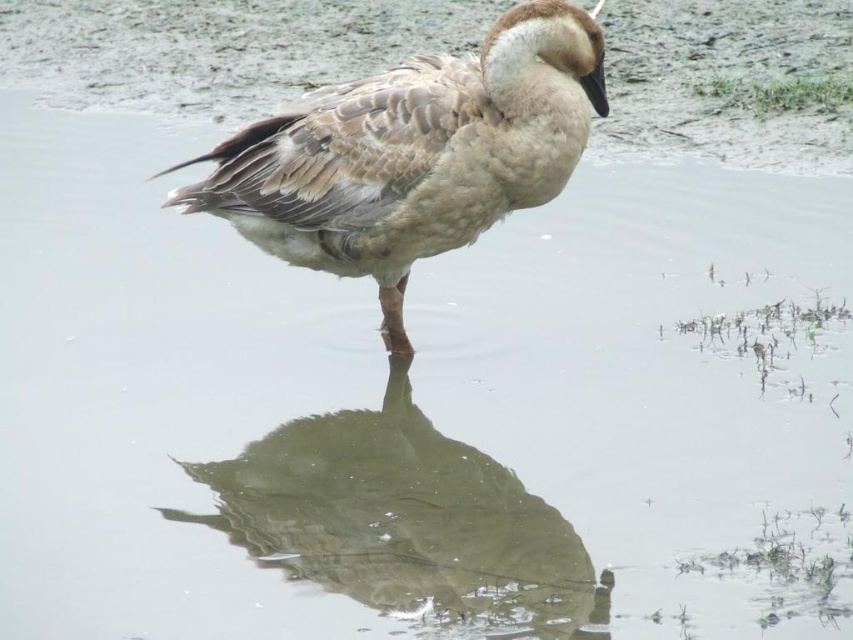
Looking at this image, you are standing at the edge of a pond and see a goose in the center. You want to throw a small pebble to hit the exact spot where the goose is standing. The coordinates of the target are point (413, 154). Can you confirm if this point is on the goose?

Yes, the point (413, 154) is on the brown speckled duck at center, so the pebble will hit the goose.